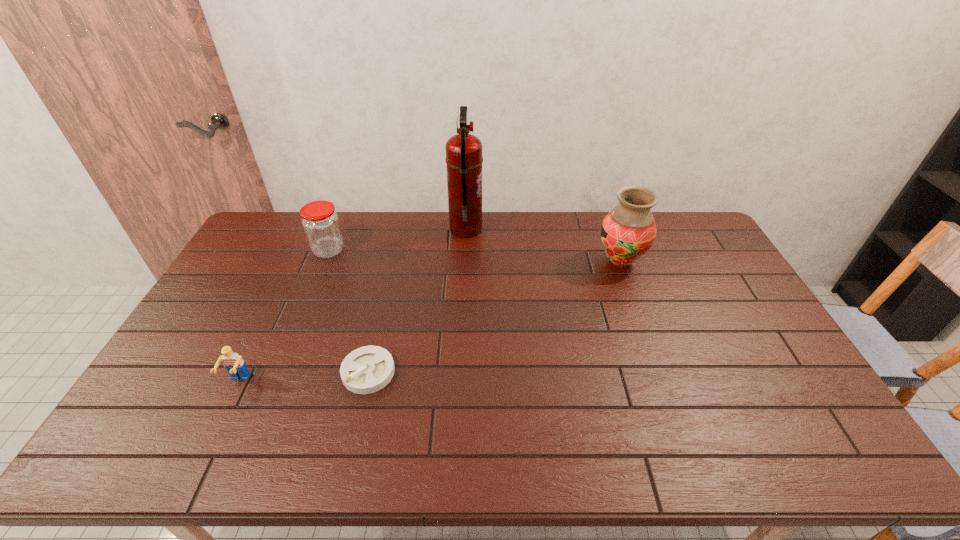
Locate an element on the screen. vacant area located 0.120m on the side of the tallest object with the handle and hose is located at coordinates (514, 229).

Identify the location of free space located 0.260m on the left of the vase. (520, 262).

This screenshot has width=960, height=540. What are the coordinates of `free spot located on the left of the jar` in the screenshot? It's located at (248, 250).

At what (x,y) coordinates should I click in order to perform the action: click on free space located on the face of the Lego. Please return your answer as a coordinate pair (x, y). The width and height of the screenshot is (960, 540). Looking at the image, I should click on (220, 419).

What are the coordinates of `vacant space positioned on the left of the third object from right to left` in the screenshot? It's located at (196, 372).

Where is `fire extinguisher that is positioned at the far edge`? The width and height of the screenshot is (960, 540). fire extinguisher that is positioned at the far edge is located at coordinates (464, 159).

Identify the location of vase located in the far edge section of the desktop. This screenshot has width=960, height=540. (628, 231).

You are a GUI agent. You are given a task and a screenshot of the screen. Output one action in this format:
    pyautogui.click(x=<x>, y=<y>)
    Task: Click on the jar situated at the far edge
    The image size is (960, 540).
    Given the screenshot: What is the action you would take?
    pyautogui.click(x=320, y=222)

Identify the location of vacant space at the far edge. The width and height of the screenshot is (960, 540). (563, 222).

In the image, there is a desktop. Where is `free space at the near edge`? The width and height of the screenshot is (960, 540). free space at the near edge is located at coordinates (342, 461).